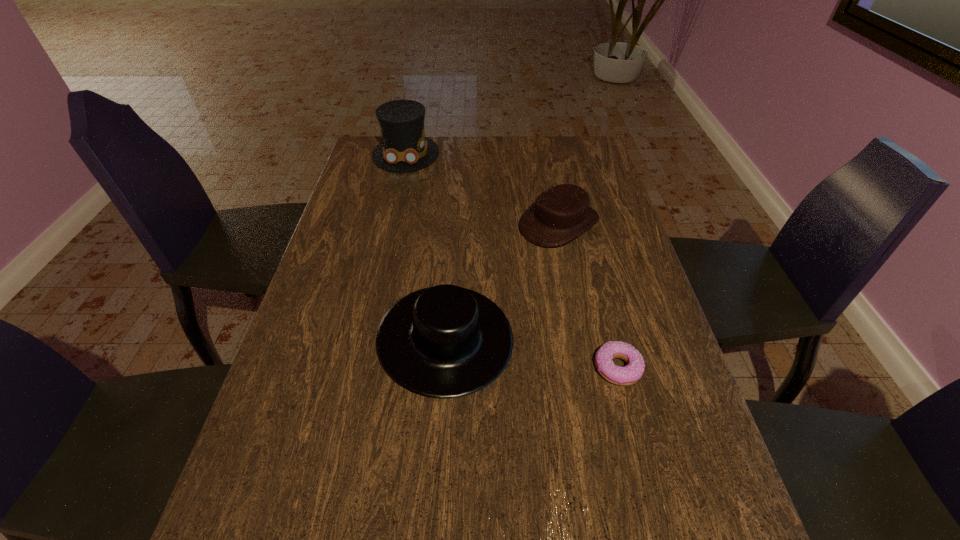
Where is `free region that satisfies the following two spatial constraints: 1. with goggles on the front of the tallest hat; 2. on the right side of the doughnut`? The image size is (960, 540). free region that satisfies the following two spatial constraints: 1. with goggles on the front of the tallest hat; 2. on the right side of the doughnut is located at coordinates (356, 368).

Find the location of a particular element. Image resolution: width=960 pixels, height=540 pixels. blank space that satisfies the following two spatial constraints: 1. with goggles on the front of the doughnut; 2. on the left side of the farthest object is located at coordinates pyautogui.click(x=356, y=368).

You are a GUI agent. You are given a task and a screenshot of the screen. Output one action in this format:
    pyautogui.click(x=<x>, y=<y>)
    Task: Click on the vacant space that satisfies the following two spatial constraints: 1. with goggles on the front of the nearest hat; 2. on the left side of the tallest object
    
    Given the screenshot: What is the action you would take?
    pyautogui.click(x=363, y=339)